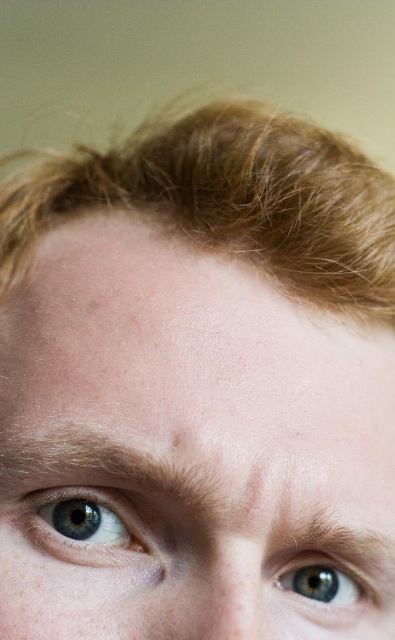
Between pale skin at center and blue matte eye at upper left, which one appears on the left side from the viewer's perspective?

blue matte eye at upper left is more to the left.

Is pale skin at center shorter than blue matte eye at upper left?

No, pale skin at center is not shorter than blue matte eye at upper left.

Measure the distance between pale skin at center and camera.

They are 10.64 inches apart.

Locate an element on the screen. pale skin at center is located at coordinates (186, 445).

Is light brown textured hair at upper center thinner than blue matte eye at upper left?

In fact, light brown textured hair at upper center might be wider than blue matte eye at upper left.

The image size is (395, 640). Find the location of `light brown textured hair at upper center`. light brown textured hair at upper center is located at coordinates (231, 200).

Is light brown textured hair at upper center shorter than blue matte eye at center?

In fact, light brown textured hair at upper center may be taller than blue matte eye at center.

Does light brown textured hair at upper center have a greater height compared to blue matte eye at center?

Yes, light brown textured hair at upper center is taller than blue matte eye at center.

The height and width of the screenshot is (640, 395). What do you see at coordinates (231, 200) in the screenshot? I see `light brown textured hair at upper center` at bounding box center [231, 200].

Identify the location of light brown textured hair at upper center. The image size is (395, 640). (231, 200).